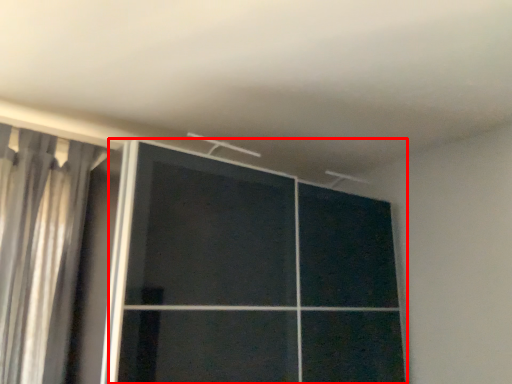
Question: From the image's perspective, where is door (annotated by the red box) located relative to curtain?

Choices:
 (A) above
 (B) below

Answer: (B)